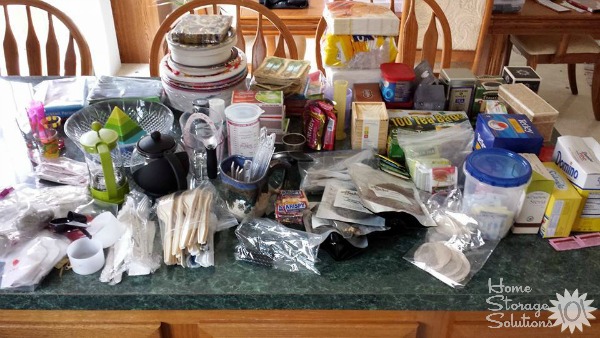
This screenshot has height=338, width=600. I want to click on table lid, so click(561, 25).